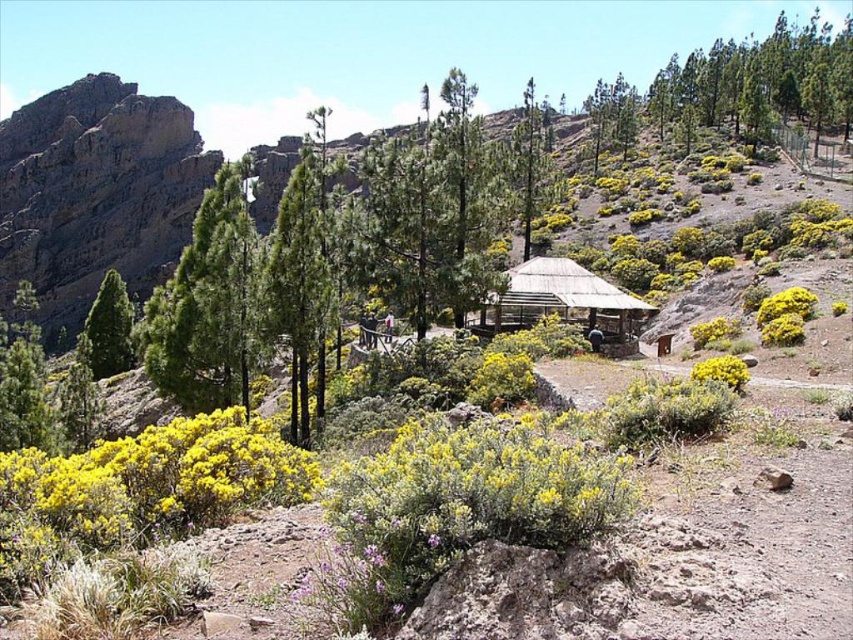
Which is in front, point (189, 337) or point (732, 358)?

Positioned in front is point (732, 358).

Measure the distance from green textured tree at center-left to yellow matte flower at center.

29.57 meters

Find the location of a particular element. This screenshot has height=640, width=853. green textured tree at center-left is located at coordinates pos(207,307).

Is yellow matte flower at center bigger than yellow matte flower at lower right?

Yes.

Describe the element at coordinates (721, 371) in the screenshot. I see `yellow matte flower at center` at that location.

Identify the location of yellow matte flower at center. This screenshot has height=640, width=853. (721, 371).

Is point (316, 220) behind point (540, 289)?

No, it is not.

Does green matte tree at center appear on the right side of wooden thatched hut at center?

Incorrect, green matte tree at center is not on the right side of wooden thatched hut at center.

Between point (285, 314) and point (581, 304), which one is positioned in front?

Positioned in front is point (285, 314).

Image resolution: width=853 pixels, height=640 pixels. What are the coordinates of `green matte tree at center` in the screenshot? It's located at (299, 285).